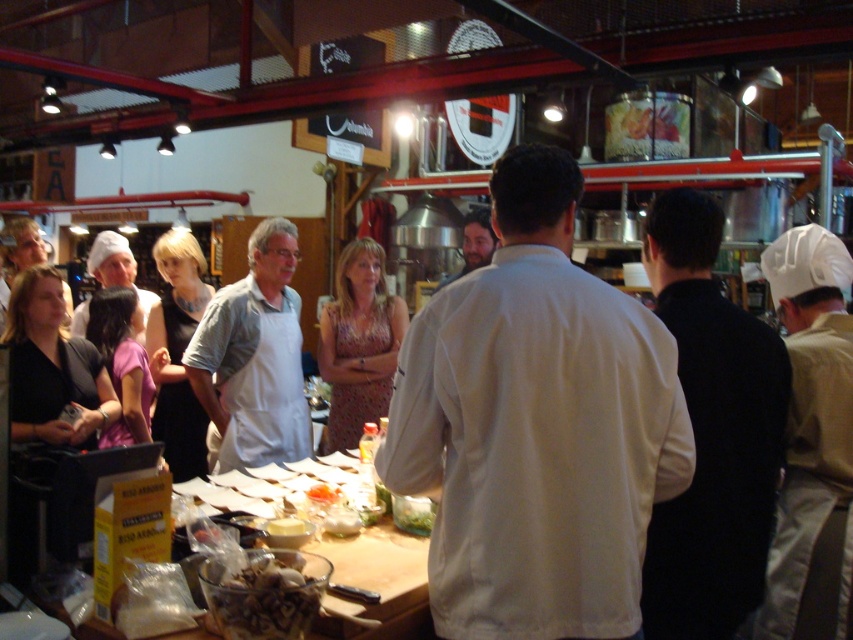
Is point (114, 268) in front of point (283, 531)?

No, it is behind (283, 531).

Between white chef hat at center and white creamy cheese at center, which one appears on the right side from the viewer's perspective?

From the viewer's perspective, white creamy cheese at center appears more on the right side.

Locate an element on the screen. white chef hat at center is located at coordinates click(x=115, y=266).

Can you confirm if black matte apron at center is positioned above white creamy cheese at center?

Yes.

Between black matte apron at center and white creamy cheese at center, which one has less height?

With less height is white creamy cheese at center.

You are a GUI agent. You are given a task and a screenshot of the screen. Output one action in this format:
    pyautogui.click(x=<x>, y=<y>)
    Task: Click on the black matte apron at center
    The height and width of the screenshot is (640, 853).
    Given the screenshot: What is the action you would take?
    pyautogui.click(x=711, y=433)

Is black matte apron at center closer to camera compared to matte white chef hat at upper left?

That is True.

Who is more forward, (708, 422) or (16, 260)?

Point (708, 422)

At what (x,y) coordinates should I click in order to perform the action: click on black matte apron at center. Please return your answer as a coordinate pair (x, y). This screenshot has width=853, height=640. Looking at the image, I should click on (711, 433).